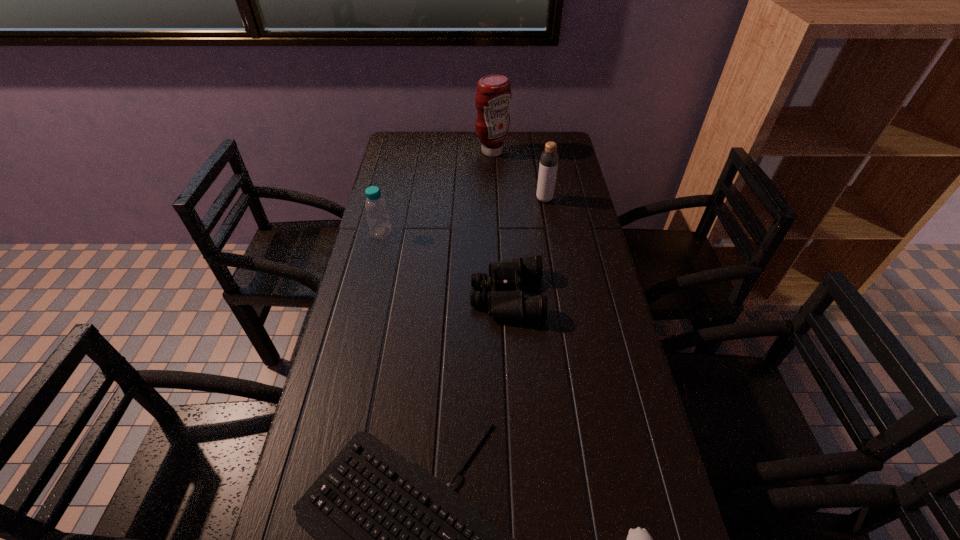
I want to click on free space between the fifth shortest object and the fourth shortest object, so click(x=463, y=215).

Identify the location of free spot between the binoculars and the third farthest object. Image resolution: width=960 pixels, height=540 pixels. (444, 264).

This screenshot has width=960, height=540. Identify the location of object that can be found as the fifth closest to the computer keyboard. (493, 96).

Where is `object that is the fifth closest one to the rightmost object`? Image resolution: width=960 pixels, height=540 pixels. object that is the fifth closest one to the rightmost object is located at coordinates (493, 96).

Select which bottle appears as the closest to the third farthest object. Please provide its 2D coordinates. Your answer should be formatted as a tuple, i.e. [(x, y)], where the tuple contains the x and y coordinates of a point satisfying the conditions above.

[(549, 158)]

Select which bottle appears as the closest to the third shortest object. Please provide its 2D coordinates. Your answer should be formatted as a tuple, i.e. [(x, y)], where the tuple contains the x and y coordinates of a point satisfying the conditions above.

[(376, 210)]

The height and width of the screenshot is (540, 960). Identify the location of blank area in the image that satisfies the following two spatial constraints: 1. on the front side of the second bottle from right to left; 2. on the left side of the farthest object. (494, 199).